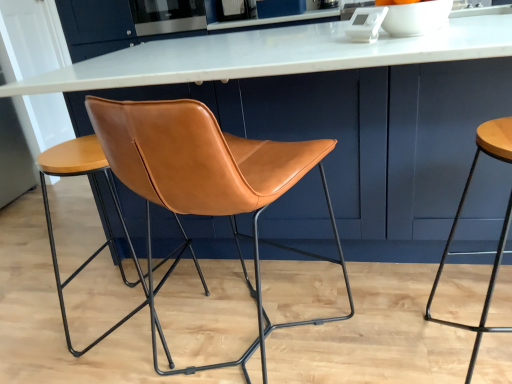
Locate an element on the screen. The image size is (512, 384). vacant space to the right of saddle brown leather chair at center is located at coordinates (381, 313).